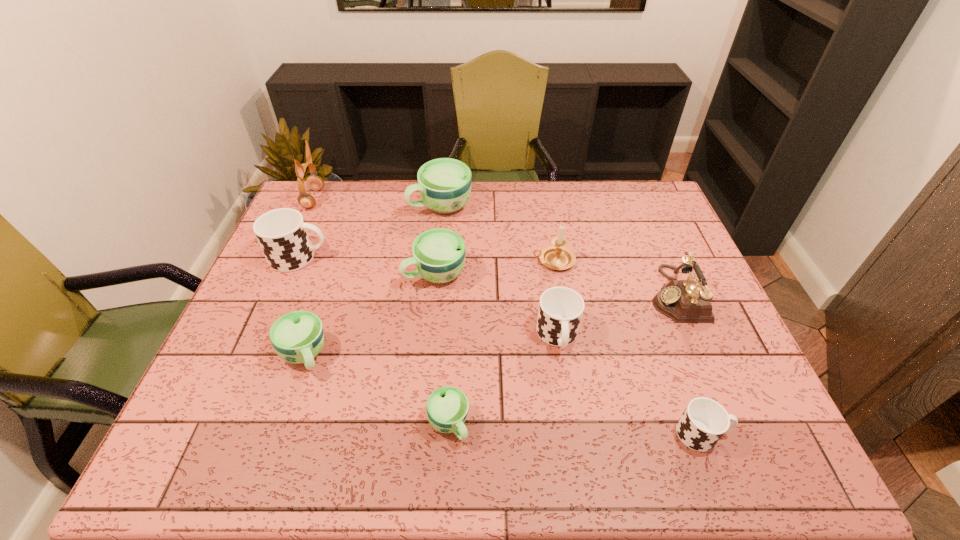
Locate an element on the screen. The image size is (960, 540). free space between the candle holder and the biggest blue cup is located at coordinates (497, 233).

At what (x,y) coordinates should I click in order to perform the action: click on object that stands as the third closest to the farthest cup. Please return your answer as a coordinate pair (x, y). The width and height of the screenshot is (960, 540). Looking at the image, I should click on (282, 233).

Where is `object that ranks as the second closest to the second nearest blue cup`? This screenshot has width=960, height=540. object that ranks as the second closest to the second nearest blue cup is located at coordinates (282, 233).

This screenshot has height=540, width=960. Identify the location of cup that is the seventh closest one to the beige candle holder. [x=282, y=233].

Where is `cup that is the closest to the smallest blue cup`? This screenshot has height=540, width=960. cup that is the closest to the smallest blue cup is located at coordinates (560, 311).

Find the location of a particular element. The height and width of the screenshot is (540, 960). blue cup that is the second closest to the leftmost blue cup is located at coordinates (447, 407).

Identify the location of the closest blue cup to the nearest black cup. (447, 407).

Locate an element on the screen. This screenshot has height=540, width=960. black cup that is the closest to the nearest black cup is located at coordinates pos(560,311).

Point out which black cup is positioned as the nearest to the black telephone. Please provide its 2D coordinates. Your answer should be formatted as a tuple, i.e. [(x, y)], where the tuple contains the x and y coordinates of a point satisfying the conditions above.

[(560, 311)]

The width and height of the screenshot is (960, 540). Identify the location of free region that satisfies the following two spatial constraints: 1. on the side of the leftmost black cup with the handle; 2. on the left side of the third nearest blue cup. (293, 273).